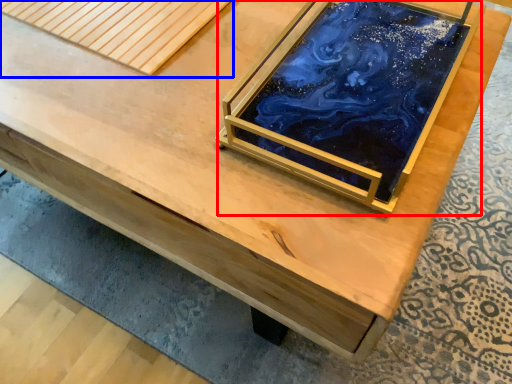
Question: Which object appears closest to the camera in this image, glass box (highlighted by a red box) or plank (highlighted by a blue box)?

Choices:
 (A) glass box
 (B) plank

Answer: (A)